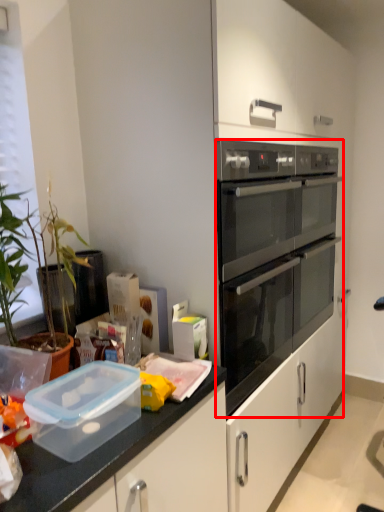
Question: Observing the image, what is the correct spatial positioning of oven (annotated by the red box) in reference to appliance?

Choices:
 (A) left
 (B) right

Answer: (B)